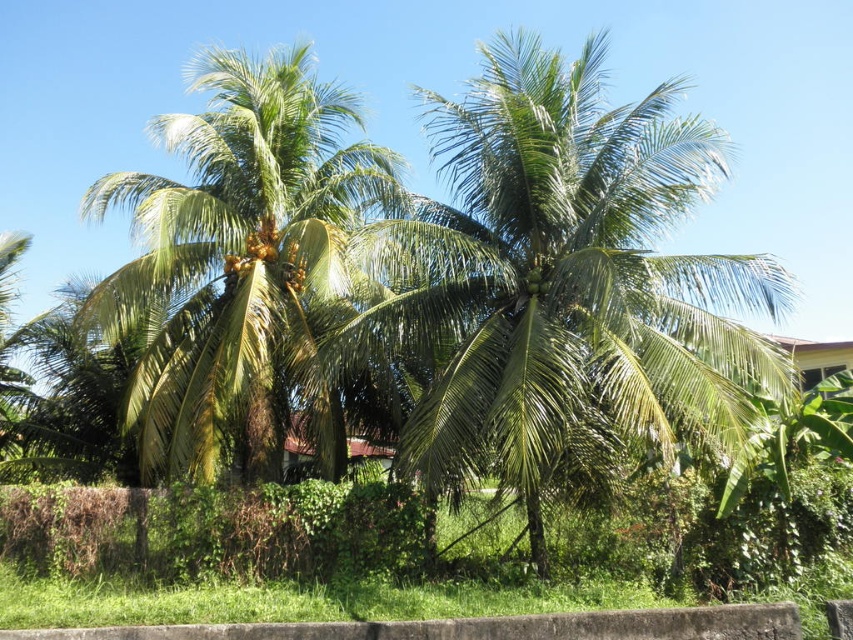
Question: Is green leafy coconut tree at center closer to the viewer compared to green leafy coconut tree at left?

Choices:
 (A) no
 (B) yes

Answer: (B)

Question: Can you confirm if green leafy coconut tree at center is smaller than green leafy coconut tree at left?

Choices:
 (A) no
 (B) yes

Answer: (A)

Question: Which point is farther to the camera?

Choices:
 (A) (489, 188)
 (B) (132, 296)

Answer: (B)

Question: Which of the following is the farthest from the observer?

Choices:
 (A) (668, 278)
 (B) (158, 449)

Answer: (B)

Question: Is green leafy coconut tree at center thinner than green leafy coconut tree at left?

Choices:
 (A) yes
 (B) no

Answer: (B)